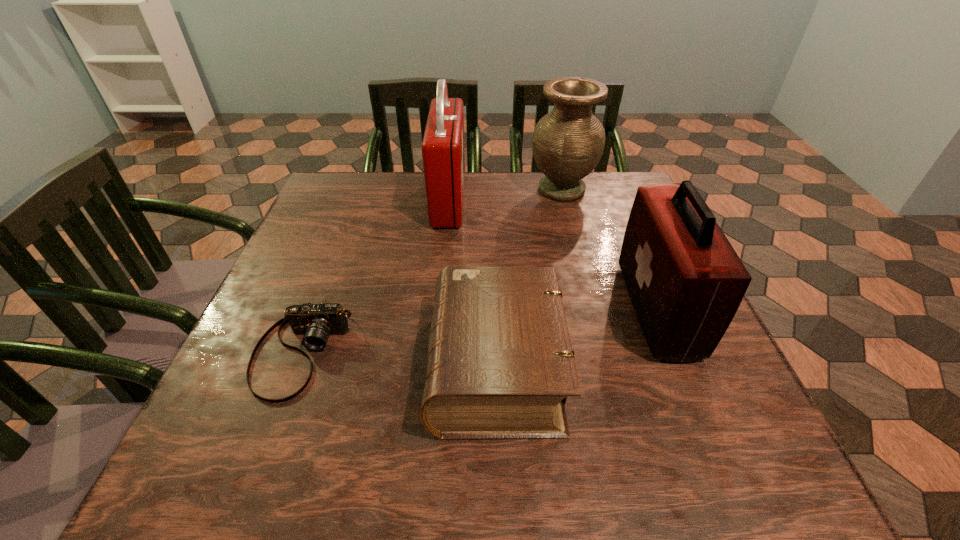
Where is `vacant point located between the vase and the right first aid kit`? The image size is (960, 540). vacant point located between the vase and the right first aid kit is located at coordinates (610, 249).

In order to click on empty location between the left first aid kit and the shortest object in this screenshot , I will do `click(374, 276)`.

Locate an element on the screen. free space between the Bible and the camera is located at coordinates (398, 360).

Where is `unoccupied position between the vase and the right first aid kit`? unoccupied position between the vase and the right first aid kit is located at coordinates (610, 249).

Find the location of a particular element. This screenshot has width=960, height=540. free area in between the leftmost object and the vase is located at coordinates (431, 272).

Identify the location of object that is the third closest to the right first aid kit. Image resolution: width=960 pixels, height=540 pixels. point(443,155).

Identify which object is located as the second nearest to the second shortest object. Please provide its 2D coordinates. Your answer should be formatted as a tuple, i.e. [(x, y)], where the tuple contains the x and y coordinates of a point satisfying the conditions above.

[(685, 280)]

Find the location of a particular element. vacant point that satisfies the following two spatial constraints: 1. on the front side of the vase; 2. on the front face of the farther first aid kit is located at coordinates (564, 200).

Image resolution: width=960 pixels, height=540 pixels. I want to click on vacant area that satisfies the following two spatial constraints: 1. on the front face of the taller first aid kit; 2. on the front-facing side of the leftmost object, so click(x=433, y=353).

The image size is (960, 540). I want to click on vacant area in the image that satisfies the following two spatial constraints: 1. on the front face of the left first aid kit; 2. on the front-facing side of the shortest object, so click(x=433, y=353).